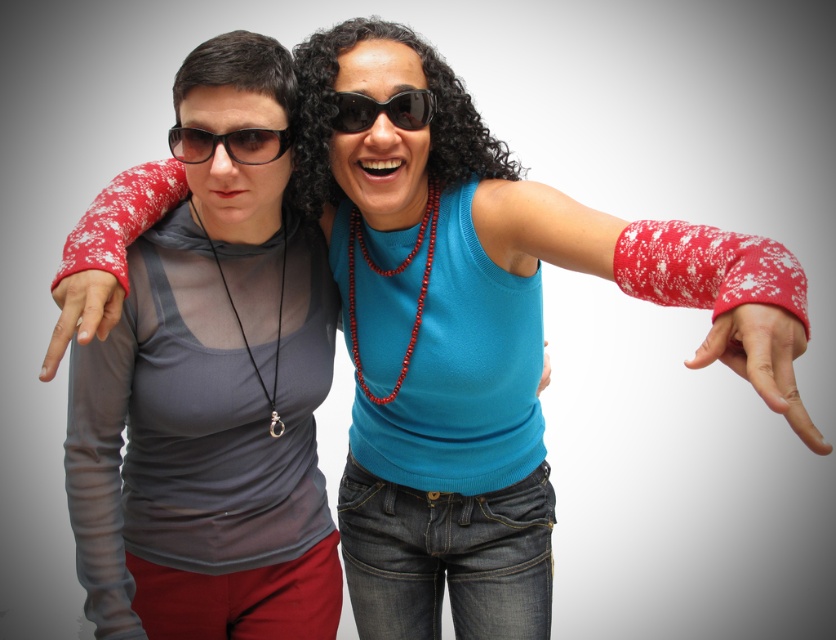
Consider the image. Can you confirm if matte gray tank top at left is positioned below red knitted wrist warmer at right?

Yes.

Is point (136, 268) positioned before point (589, 241)?

That is False.

Identify the location of matte gray tank top at left. (209, 424).

Does matte gray tank top at left have a larger size compared to red knitted wrist warmer at lower right?

Indeed, matte gray tank top at left has a larger size compared to red knitted wrist warmer at lower right.

Can you confirm if matte gray tank top at left is taller than red knitted wrist warmer at lower right?

Yes, matte gray tank top at left is taller than red knitted wrist warmer at lower right.

Image resolution: width=836 pixels, height=640 pixels. Identify the location of matte gray tank top at left. (209, 424).

Does red knitted wristband at lower right have a lesser width compared to red knitted wrist warmer at lower right?

No.

Does point (747, 348) come farther from viewer compared to point (546, 372)?

No.

The image size is (836, 640). In order to click on red knitted wristband at lower right in this screenshot , I will do `click(763, 358)`.